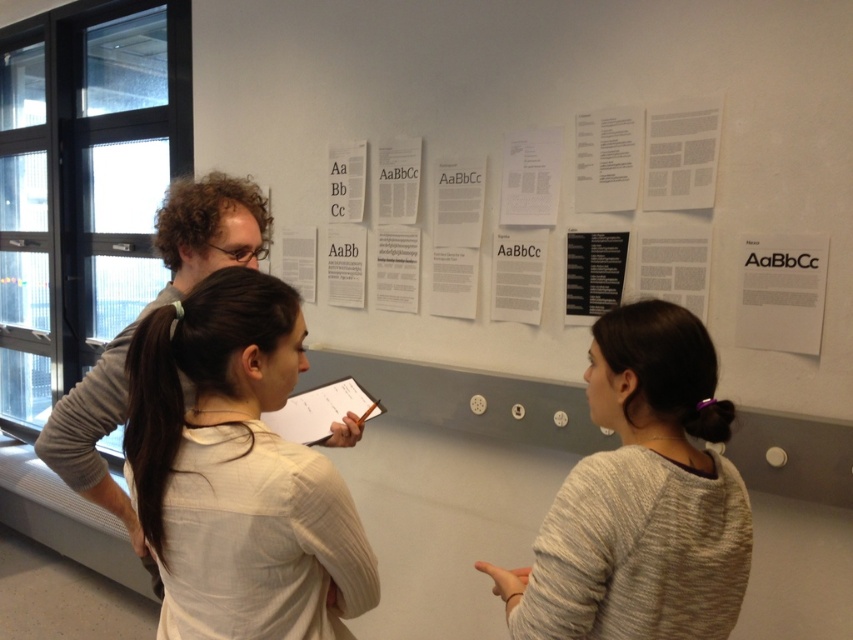
Question: Does gray sweater at center have a smaller size compared to white paper clipboard at center?

Choices:
 (A) yes
 (B) no

Answer: (B)

Question: Based on their relative distances, which object is nearer to the gray sweater at center?

Choices:
 (A) white fabric shirt at center
 (B) white paper at right

Answer: (A)

Question: Which object is positioned farthest from the gray sweater at center?

Choices:
 (A) white paper clipboard at center
 (B) brown smooth hair at center
 (C) white paper at right
 (D) white fabric shirt at center

Answer: (C)

Question: Estimate the real-world distances between objects in this image. Which object is farther from the brown smooth hair at center?

Choices:
 (A) white paper at right
 (B) white paper clipboard at center

Answer: (A)

Question: Is brown smooth hair at center closer to the viewer compared to white paper clipboard at center?

Choices:
 (A) no
 (B) yes

Answer: (B)

Question: Can you confirm if white fabric shirt at center is wider than brown smooth hair at center?

Choices:
 (A) yes
 (B) no

Answer: (A)